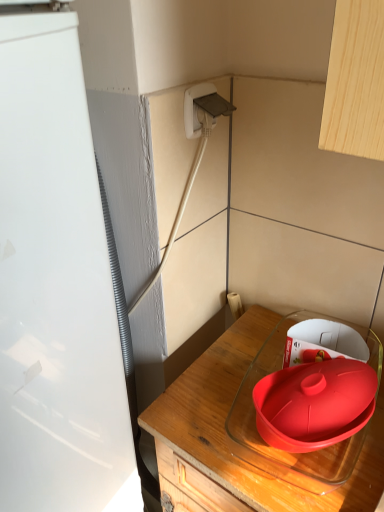
Question: Is white glossy refrigerator at left at the left side of white plastic plug at upper center?

Choices:
 (A) yes
 (B) no

Answer: (A)

Question: Considering the relative sizes of white glossy refrigerator at left and white plastic plug at upper center in the image provided, is white glossy refrigerator at left shorter than white plastic plug at upper center?

Choices:
 (A) no
 (B) yes

Answer: (A)

Question: Can you confirm if white glossy refrigerator at left is bigger than white plastic plug at upper center?

Choices:
 (A) yes
 (B) no

Answer: (A)

Question: Considering the relative sizes of white glossy refrigerator at left and white plastic plug at upper center in the image provided, is white glossy refrigerator at left taller than white plastic plug at upper center?

Choices:
 (A) no
 (B) yes

Answer: (B)

Question: From a real-world perspective, does white glossy refrigerator at left stand above white plastic plug at upper center?

Choices:
 (A) no
 (B) yes

Answer: (A)

Question: Is white glossy refrigerator at left positioned with its back to white plastic plug at upper center?

Choices:
 (A) yes
 (B) no

Answer: (B)

Question: Can you confirm if white plastic plug at upper center is bigger than white glossy refrigerator at left?

Choices:
 (A) yes
 (B) no

Answer: (B)

Question: Does white plastic plug at upper center have a lesser height compared to white glossy refrigerator at left?

Choices:
 (A) no
 (B) yes

Answer: (B)

Question: Is white plastic plug at upper center positioned in front of white glossy refrigerator at left?

Choices:
 (A) yes
 (B) no

Answer: (B)

Question: Does white plastic plug at upper center have a greater height compared to white glossy refrigerator at left?

Choices:
 (A) yes
 (B) no

Answer: (B)

Question: Is white plastic plug at upper center located outside white glossy refrigerator at left?

Choices:
 (A) no
 (B) yes

Answer: (B)

Question: Are white plastic plug at upper center and white glossy refrigerator at left beside each other?

Choices:
 (A) no
 (B) yes

Answer: (A)

Question: Considering the relative sizes of white plastic plug at upper center and transparent glass container at lower right in the image provided, is white plastic plug at upper center taller than transparent glass container at lower right?

Choices:
 (A) yes
 (B) no

Answer: (B)